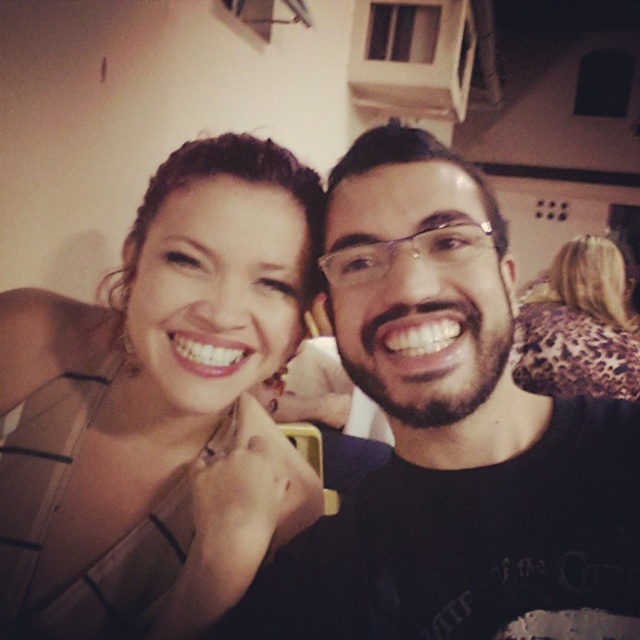
You are standing in the room and want to place a new painting on the wall. The painting is 0.5 meters wide and needs to be placed exactly at the position of the point marked as point (160,406). Is there enough space there to hang the painting without overlapping any objects?

The satin beige dress at upper left is represented by point (160,406). Since the point is where the dress is located, placing the painting there would overlap with the dress, so it is not possible to hang the painting without overlapping an object.

You are standing in the room where the two people are posing. You need to place a small decoration between the two points, point (131, 314) and point (536, 333). Which point should the decoration be closer to in order to be between them?

The decoration should be closer to point (131, 314) because it is in front of point (536, 333).